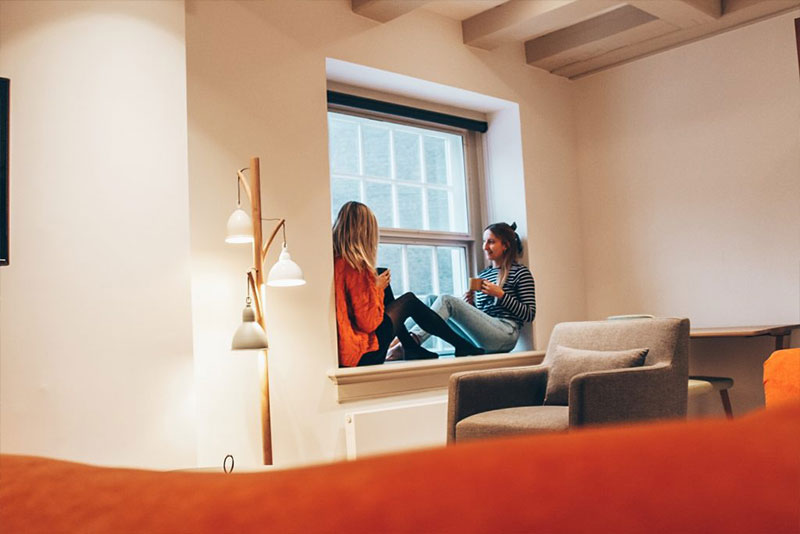
Find the location of `front right chair leg`. front right chair leg is located at coordinates (728, 405).